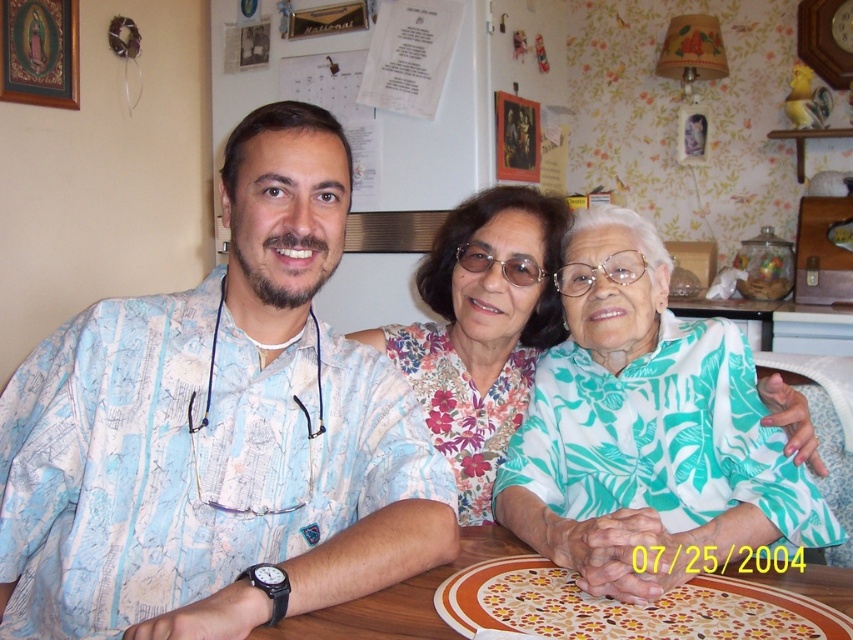
You are arranging a centerpiece for a dinner party and want to place it exactly in the middle of the wooden table at center. However, there is a floral fabric blouse at center already on the table. Where should you place the centerpiece so it doesn,t interfere with the blouse?

The floral fabric blouse at center is to the right of the wooden table at center, so placing the centerpiece to the left of the blouse would keep it centered on the table without overlapping.

You are a photographer setting up for a family portrait. You want to ensure that the teal floral shirt at center and the wooden table at center are both in focus. Given that your camera can only sharply focus on objects within a 10 inch range, will both objects be in focus?

The teal floral shirt at center is 11.81 inches from the wooden table at center. Since the distance between them exceeds the 10 inch focus range, they cannot both be in focus simultaneously.

You are planning to place a new decorative item on the wooden table at center. However, you notice the floral fabric blouse at center is already occupying space. Based on their sizes, will the blouse block most of the table surface?

The floral fabric blouse at center is larger in size than wooden table at center, so it would indeed block most of the table surface.